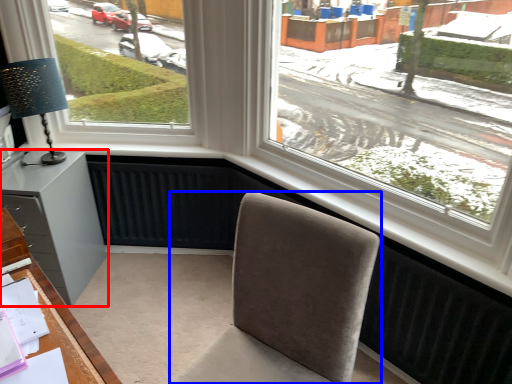
Question: Which object is closer to the camera taking this photo, cabinetry (highlighted by a red box) or chair (highlighted by a blue box)?

Choices:
 (A) cabinetry
 (B) chair

Answer: (B)